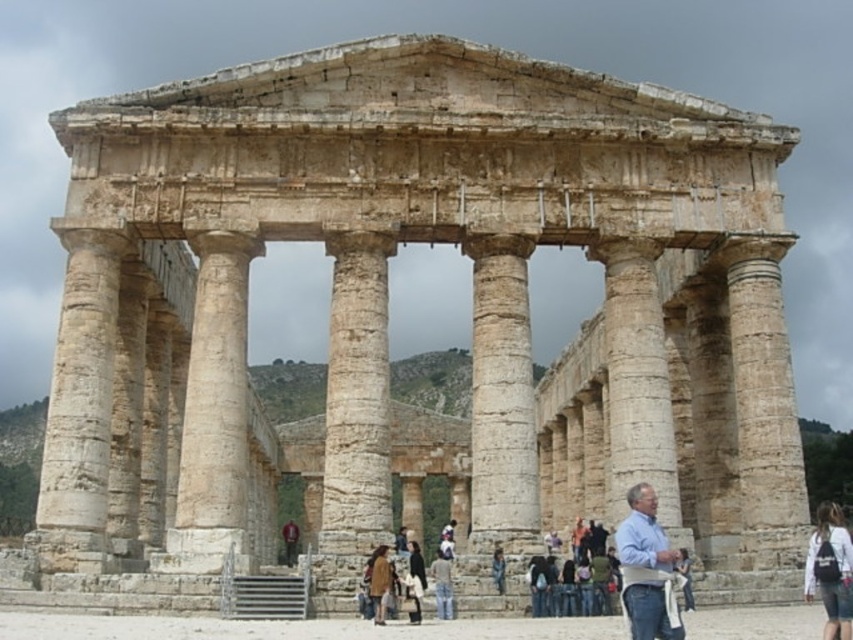
Is white stone column at center below white fabric backpack at lower right?

Actually, white stone column at center is above white fabric backpack at lower right.

Is white stone column at center above white fabric backpack at lower right?

Correct, white stone column at center is located above white fabric backpack at lower right.

Who is more forward, (373, 486) or (814, 545)?

Point (814, 545) is in front.

Locate an element on the screen. The width and height of the screenshot is (853, 640). white stone column at center is located at coordinates (355, 410).

The width and height of the screenshot is (853, 640). Describe the element at coordinates (380, 582) in the screenshot. I see `brown leather jacket at center` at that location.

Can you confirm if brown leather jacket at center is taller than dark brown leather jacket at lower center?

Correct, brown leather jacket at center is much taller as dark brown leather jacket at lower center.

This screenshot has height=640, width=853. Describe the element at coordinates (380, 582) in the screenshot. I see `brown leather jacket at center` at that location.

Find the location of a particular element. brown leather jacket at center is located at coordinates (380, 582).

Does smooth stone column at center come in front of light blue shirt at center?

No, it is behind light blue shirt at center.

Between smooth stone column at center and light blue shirt at center, which one appears on the left side from the viewer's perspective?

smooth stone column at center is more to the left.

Locate an element on the screen. smooth stone column at center is located at coordinates (500, 413).